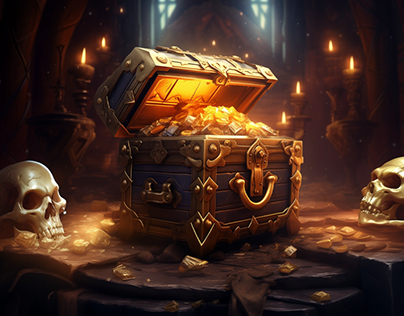
Where is `windows`? The width and height of the screenshot is (404, 316). windows is located at coordinates point(261,18), point(167,7).